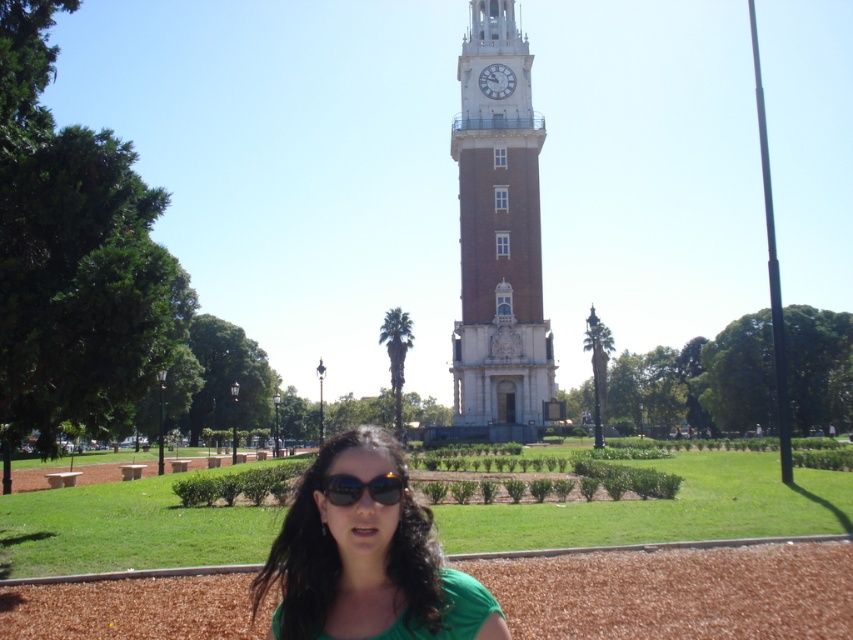
Question: Can you confirm if green matte shirt at center is wider than black reflective sunglasses at center?

Choices:
 (A) no
 (B) yes

Answer: (B)

Question: Estimate the real-world distances between objects in this image. Which object is farther from the white marble clock at upper center?

Choices:
 (A) brown brick clock tower at center
 (B) green matte shirt at center

Answer: (B)

Question: Can you confirm if black reflective sunglasses at center is bigger than white marble clock at upper center?

Choices:
 (A) no
 (B) yes

Answer: (A)

Question: Estimate the real-world distances between objects in this image. Which object is closer to the black reflective sunglasses at center?

Choices:
 (A) green matte shirt at center
 (B) brown brick clock tower at center
 (C) white marble clock at upper center

Answer: (A)

Question: Among these points, which one is nearest to the camera?

Choices:
 (A) (482, 90)
 (B) (384, 500)
 (C) (451, 593)
 (D) (480, 362)

Answer: (C)

Question: Is black reflective sunglasses at center closer to the viewer compared to white marble clock at upper center?

Choices:
 (A) no
 (B) yes

Answer: (B)